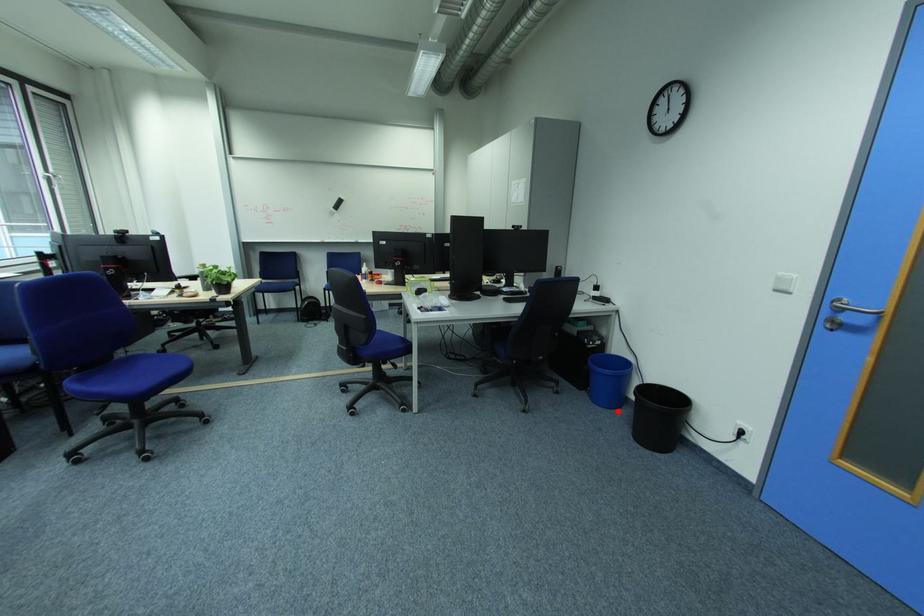
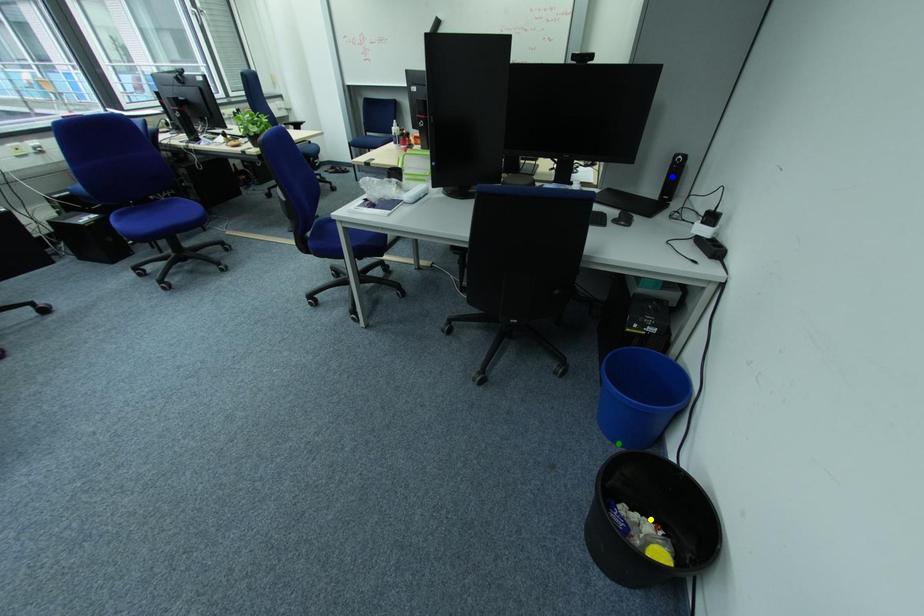
Question: I am providing you with two images of the same scene from different viewpoints. A red point is marked on the first image. You are given multiple points on the second image. Can you choose the point in image 2 that corresponds to the point in image 1?

Choices:
 (A) blue point
 (B) yellow point
 (C) green point

Answer: (C)